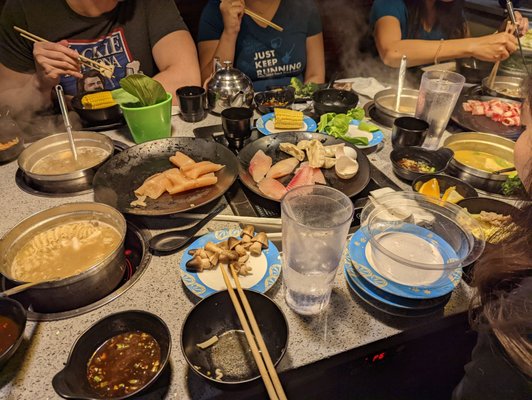
Image resolution: width=532 pixels, height=400 pixels. Identify the location of black cups. (186, 104), (239, 122), (414, 132).